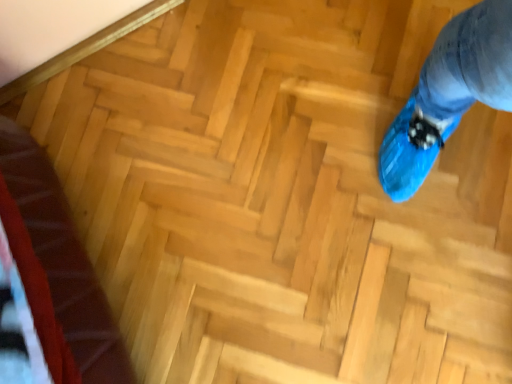
Question: Should I look upward or downward to see velvet red blanket at lower left?

Choices:
 (A) down
 (B) up

Answer: (A)